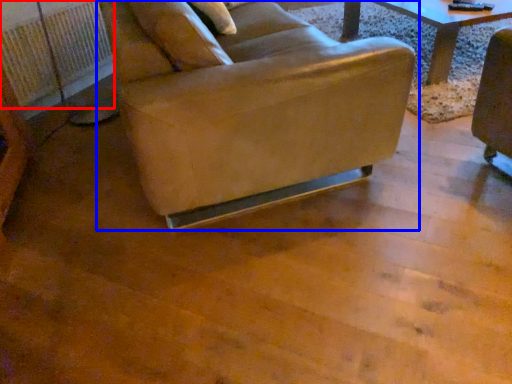
Question: Which object appears farthest to the camera in this image, radiator (highlighted by a red box) or chair (highlighted by a blue box)?

Choices:
 (A) radiator
 (B) chair

Answer: (A)